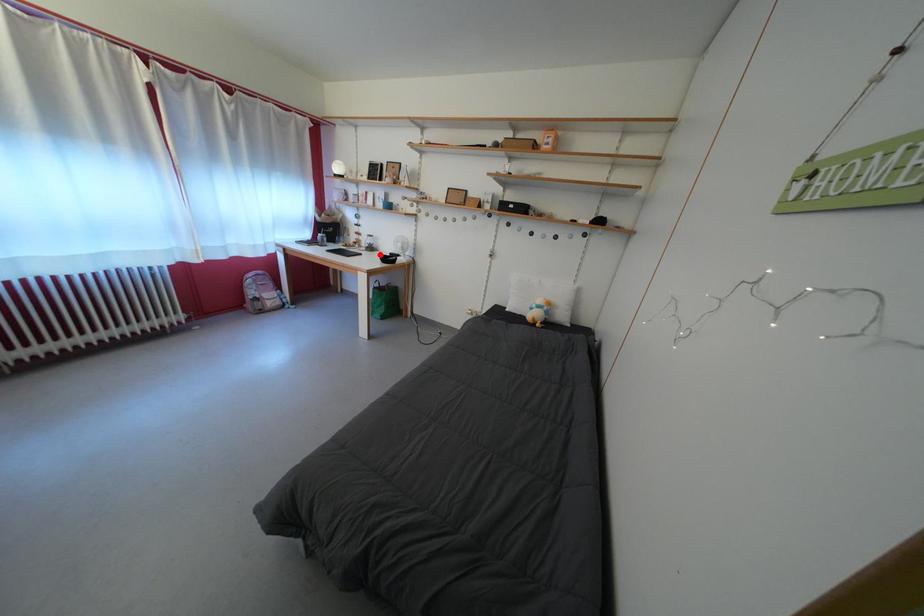
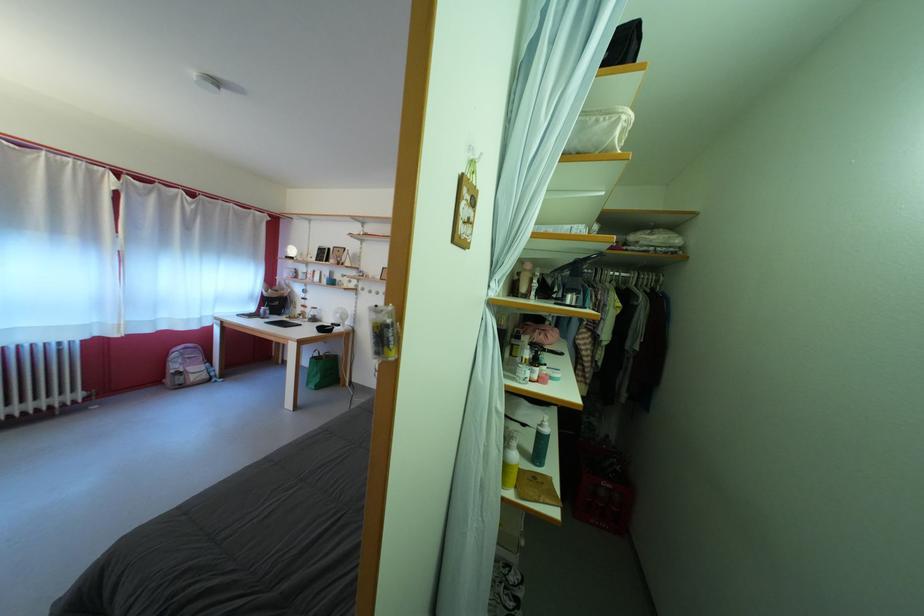
Find the pixel in the second image that matches the highlighted location in the first image.

(322, 325)